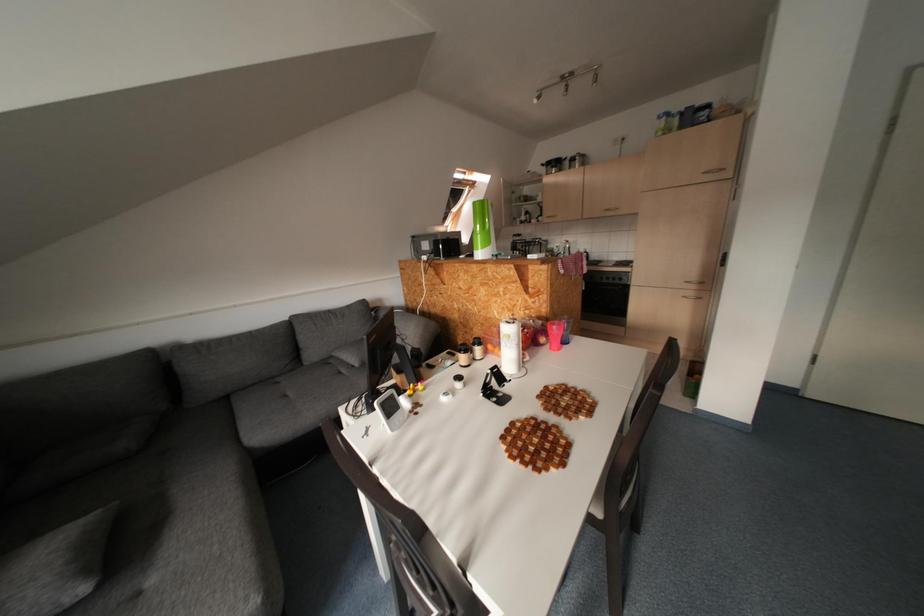
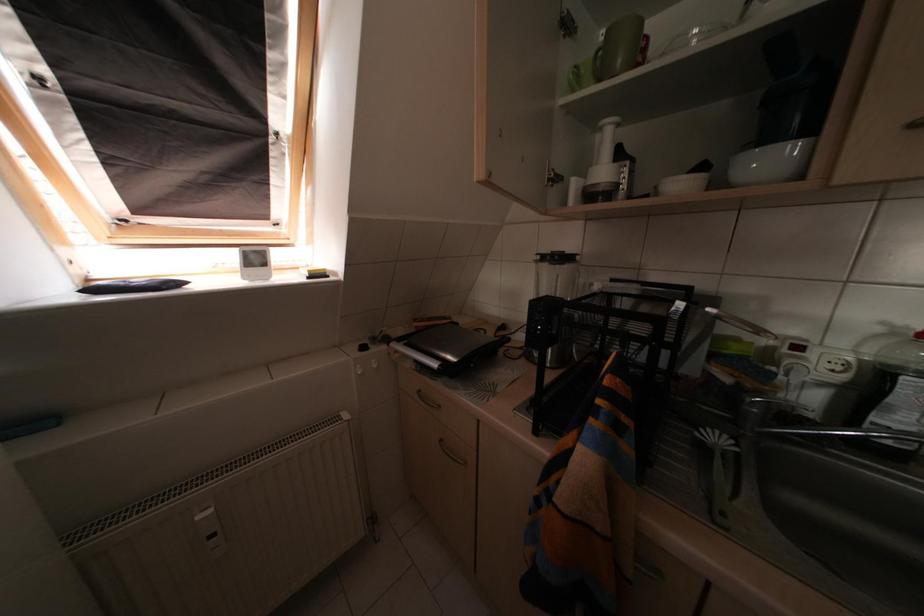
Question: What movement of the cameraman would produce the second image?

Choices:
 (A) Left
 (B) Right
 (C) Forward
 (D) Backward

Answer: (C)